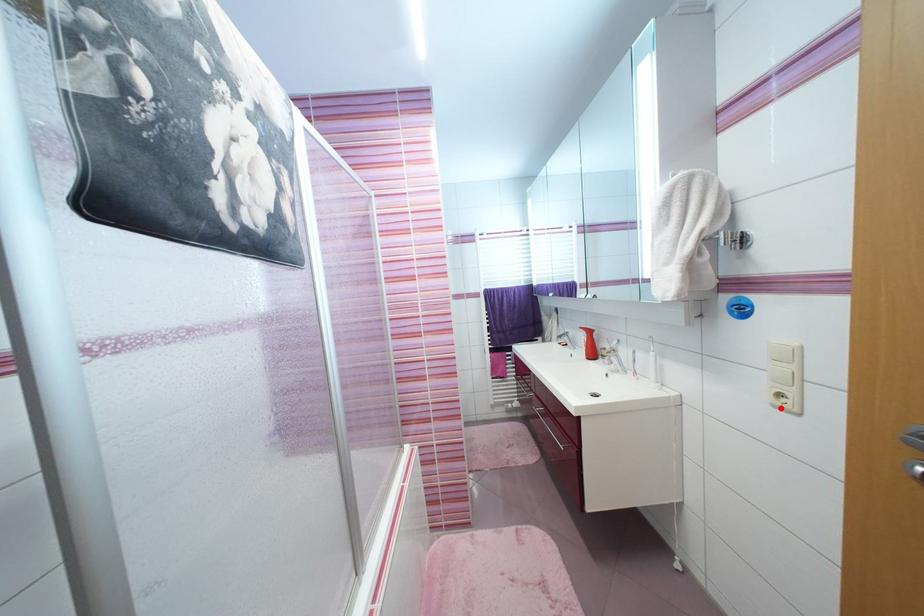
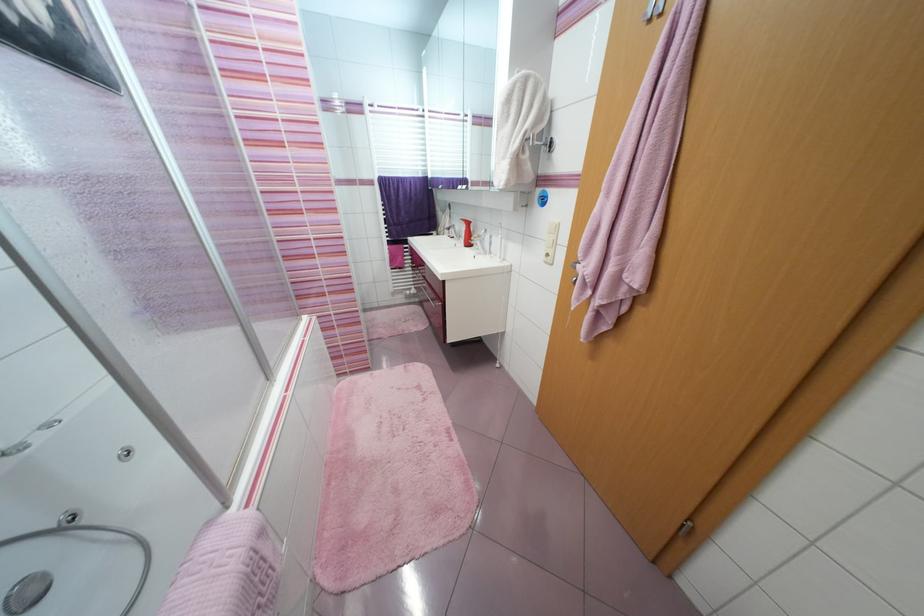
Question: A red point is marked in image1. In image2, is the corresponding 3D point closer to the camera or farther? Reply with the corresponding letter.

Choices:
 (A) The corresponding 3D point is closer.
 (B) The corresponding 3D point is farther.

Answer: (A)